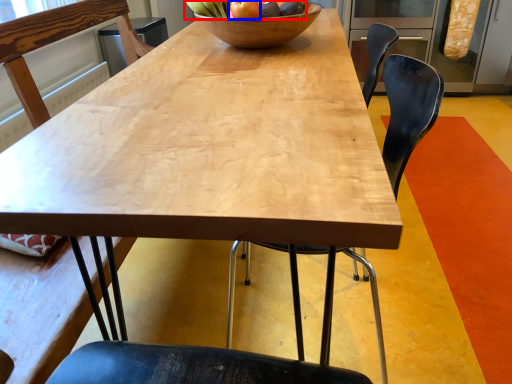
Question: Which of the following is the closest to the observer, fruit (highlighted by a red box) or apple (highlighted by a blue box)?

Choices:
 (A) fruit
 (B) apple

Answer: (B)